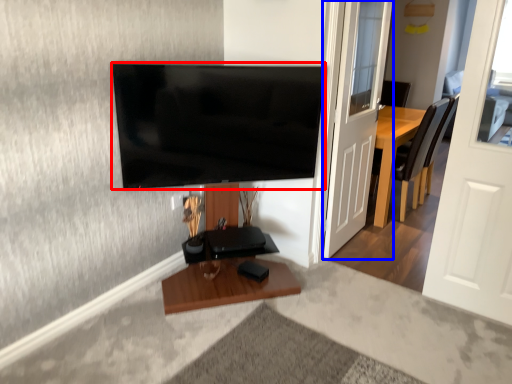
Question: Among these objects, which one is farthest to the camera, television (highlighted by a red box) or door (highlighted by a blue box)?

Choices:
 (A) television
 (B) door

Answer: (B)